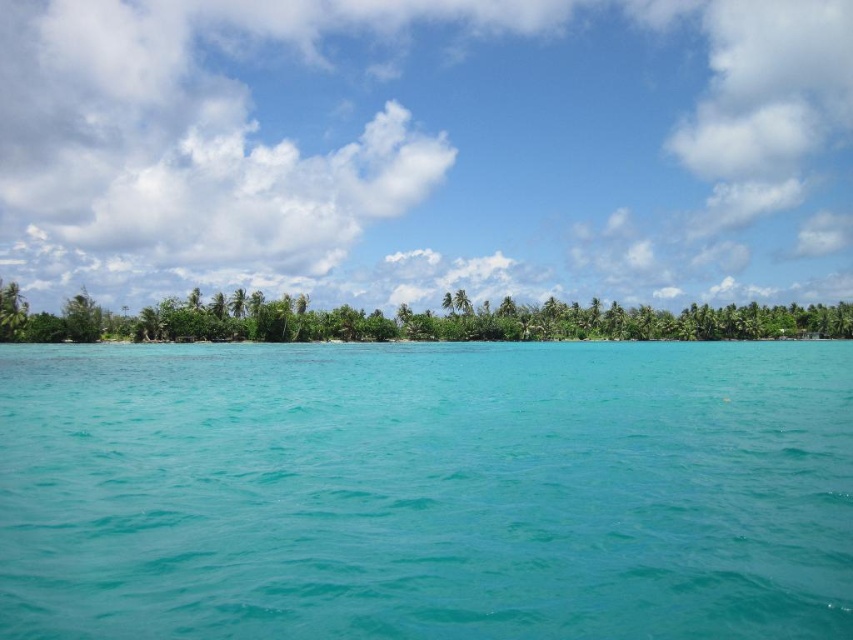
Locate an element on the screen. The width and height of the screenshot is (853, 640). turquoise glossy water at center is located at coordinates (426, 492).

Image resolution: width=853 pixels, height=640 pixels. What are the coordinates of `turquoise glossy water at center` in the screenshot? It's located at point(426,492).